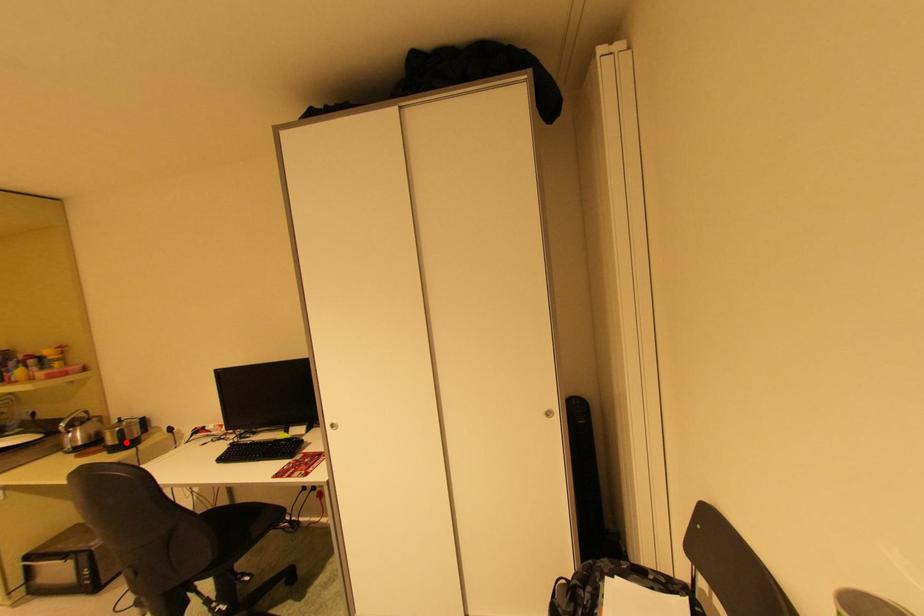
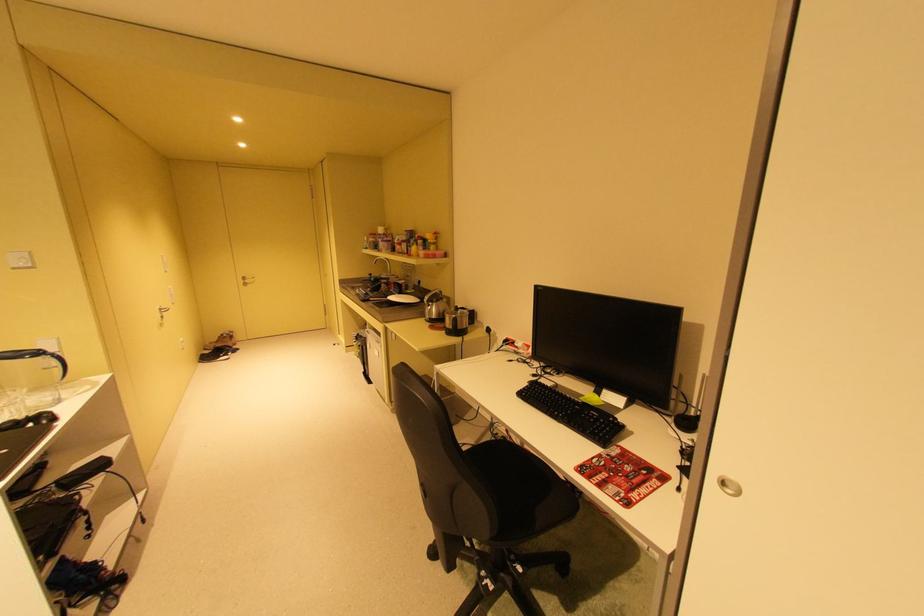
Question: A red point is marked in image1. In image2, is the corresponding 3D point closer to the camera or farther? Reply with the corresponding letter.

Choices:
 (A) The corresponding 3D point is closer.
 (B) The corresponding 3D point is farther.

Answer: (B)